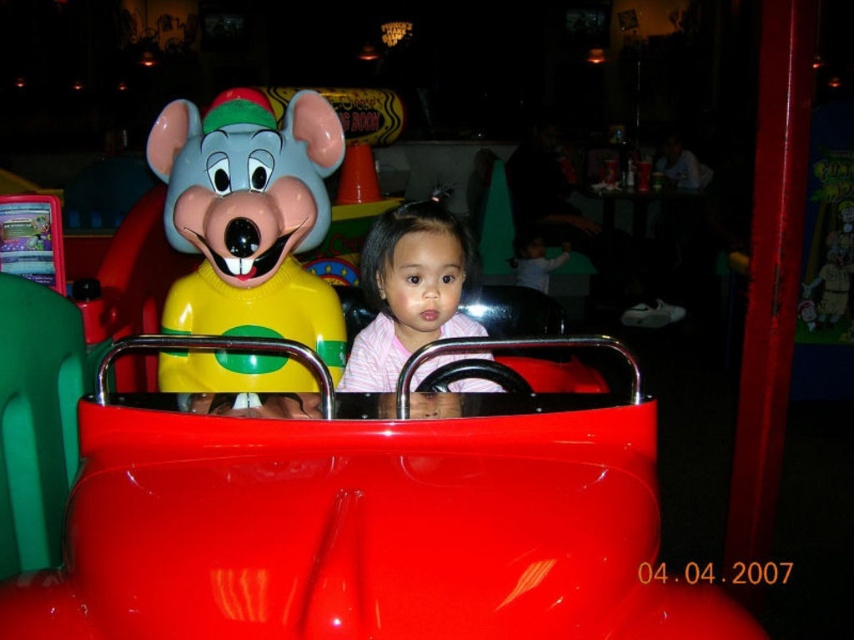
Does plastic mouse at left have a greater height compared to pink striped shirt at center?

Yes, plastic mouse at left is taller than pink striped shirt at center.

Between plastic mouse at left and pink striped shirt at center, which one has less height?

pink striped shirt at center is shorter.

You are a GUI agent. You are given a task and a screenshot of the screen. Output one action in this format:
    pyautogui.click(x=<x>, y=<y>)
    Task: Click on the plastic mouse at left
    
    Given the screenshot: What is the action you would take?
    pyautogui.click(x=250, y=218)

Is glossy plastic toy car at center shorter than plastic mouse at left?

Yes.

Is glossy plastic toy car at center to the right of plastic mouse at left from the viewer's perspective?

Yes, glossy plastic toy car at center is to the right of plastic mouse at left.

Who is more forward, (346, 428) or (230, 358)?

Point (346, 428)

Locate an element on the screen. This screenshot has width=854, height=640. glossy plastic toy car at center is located at coordinates (367, 522).

Does glossy plastic toy car at center have a lesser height compared to pink striped shirt at center?

Yes.

How distant is glossy plastic toy car at center from pink striped shirt at center?

15.23 inches

Which is behind, point (559, 445) or point (430, 204)?

The point (430, 204) is more distant.

The image size is (854, 640). I want to click on glossy plastic toy car at center, so (x=367, y=522).